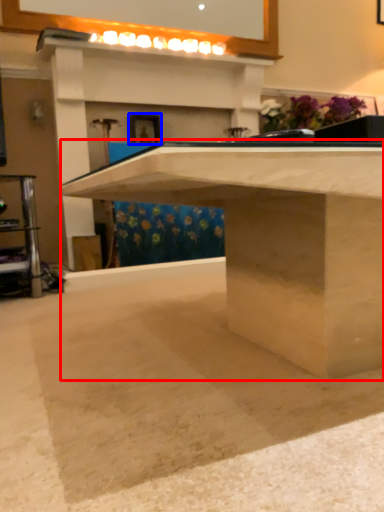
Question: Among these objects, which one is nearest to the camera, table (highlighted by a red box) or picture frame (highlighted by a blue box)?

Choices:
 (A) table
 (B) picture frame

Answer: (A)